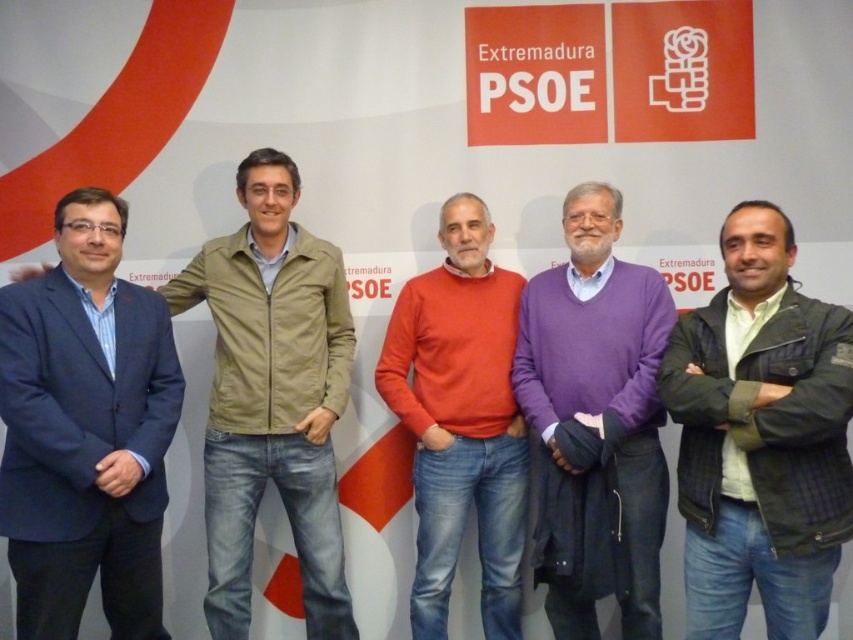
Question: Based on their relative distances, which object is nearer to the green plaid jacket at center?

Choices:
 (A) blue fabric suit at left
 (B) purple sweater at center
 (C) khaki fabric jacket at left

Answer: (B)

Question: Among these points, which one is nearest to the camera?

Choices:
 (A) (639, 516)
 (B) (131, 456)

Answer: (B)

Question: Does purple sweater at center come behind matte orange sweater at center?

Choices:
 (A) yes
 (B) no

Answer: (B)

Question: Which is nearer to the purple sweater at center?

Choices:
 (A) matte orange sweater at center
 (B) khaki fabric jacket at left
 (C) green plaid jacket at center
 (D) blue fabric suit at left

Answer: (A)

Question: Can you confirm if blue fabric suit at left is positioned above khaki fabric jacket at left?

Choices:
 (A) no
 (B) yes

Answer: (A)

Question: Is blue fabric suit at left smaller than green plaid jacket at center?

Choices:
 (A) no
 (B) yes

Answer: (B)